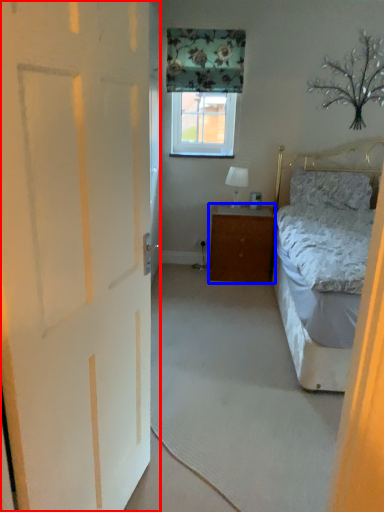
Question: Among these objects, which one is farthest to the camera, door (highlighted by a red box) or cabinetry (highlighted by a blue box)?

Choices:
 (A) door
 (B) cabinetry

Answer: (B)